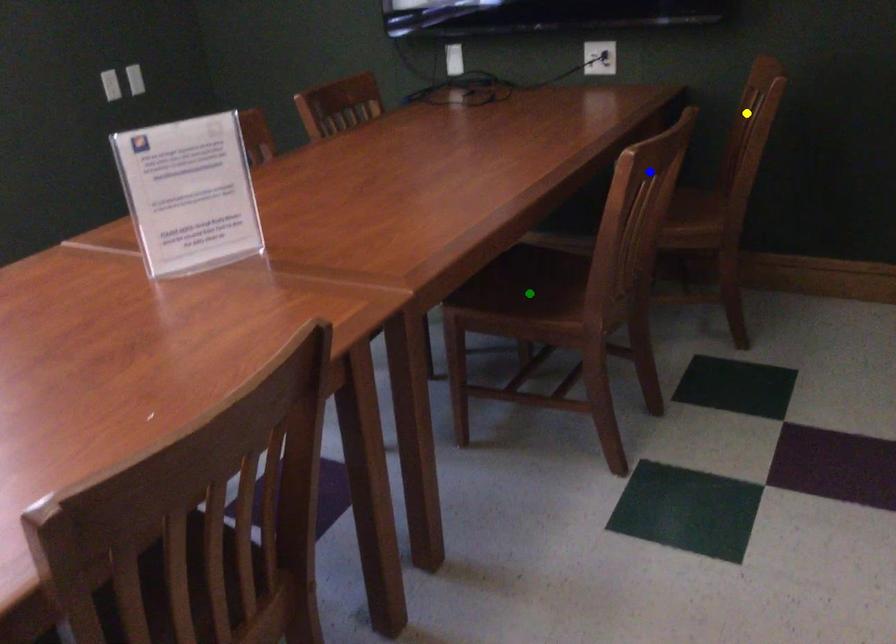
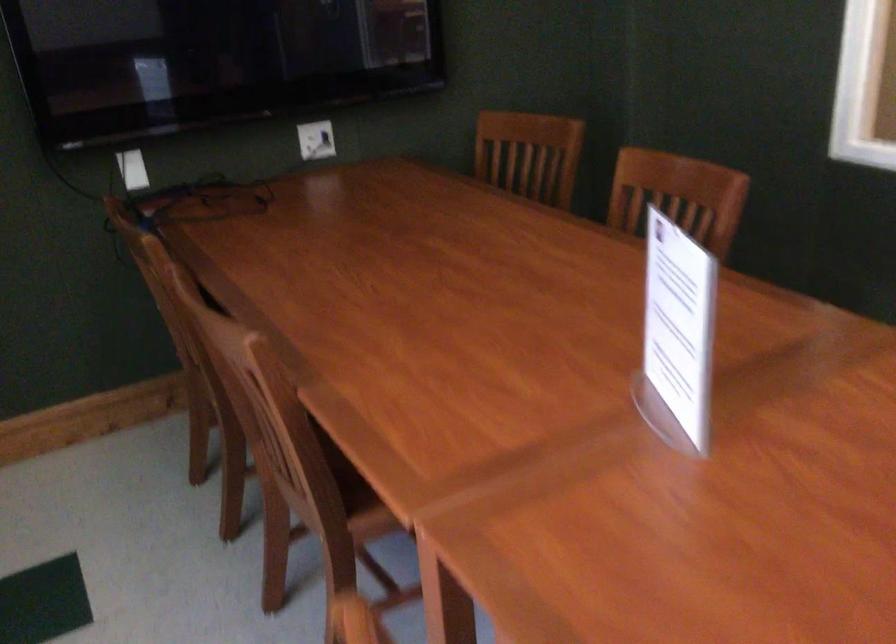
I am providing you with two images of the same scene from different viewpoints. Three points are marked in image1. Which point corresponds to a part or object that is occluded in image2?In image1, three points are marked. Which of them correspond to a part or object that is occluded in image2?Among the three points shown in image1, which one corresponds to a part or object that is no longer visible due to occlusion in image2?

Invisible in image2: green point.